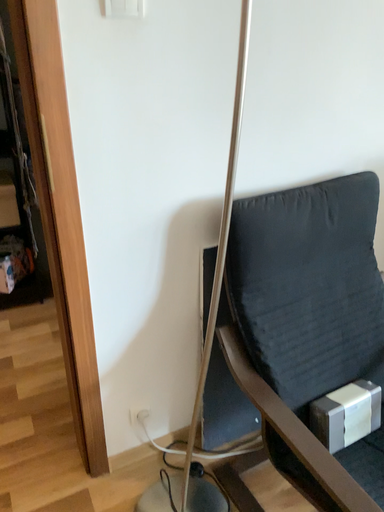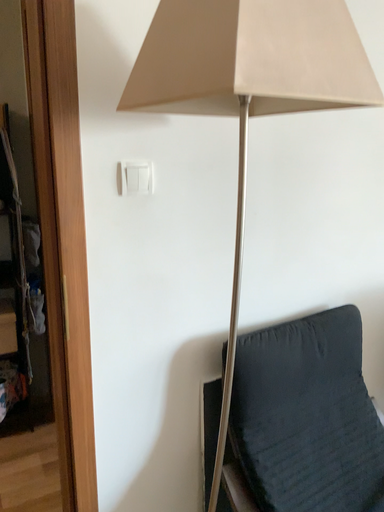
Question: How did the camera likely rotate when shooting the video?

Choices:
 (A) rotated downward
 (B) rotated upward

Answer: (B)